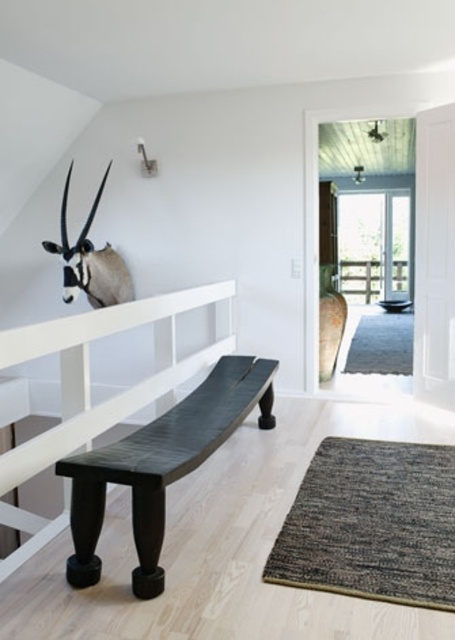
In the scene shown: Between dark wood bench at center and white matte antelope head at upper left, which one appears on the right side from the viewer's perspective?

dark wood bench at center

Between dark wood bench at center and white matte antelope head at upper left, which one has more height?

white matte antelope head at upper left is taller.

Who is more forward, (205, 404) or (66, 236)?

Point (205, 404) is in front.

Identify the location of dark wood bench at center. (160, 465).